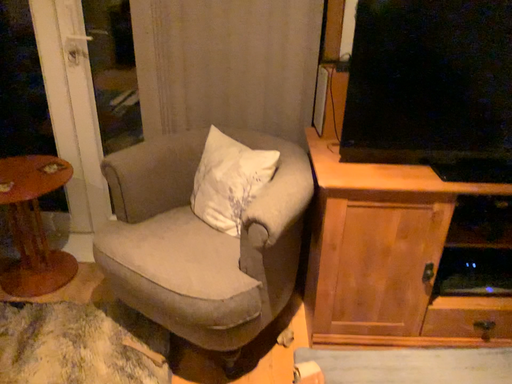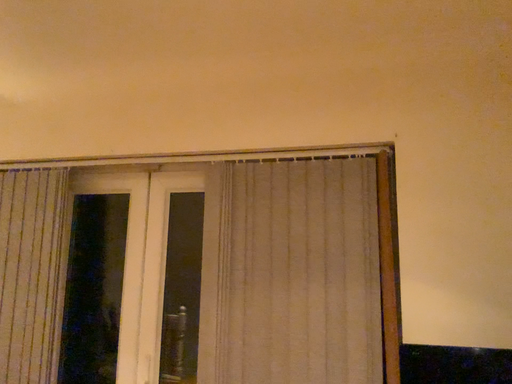
Question: How did the camera likely rotate when shooting the video?

Choices:
 (A) rotated left
 (B) rotated right

Answer: (A)